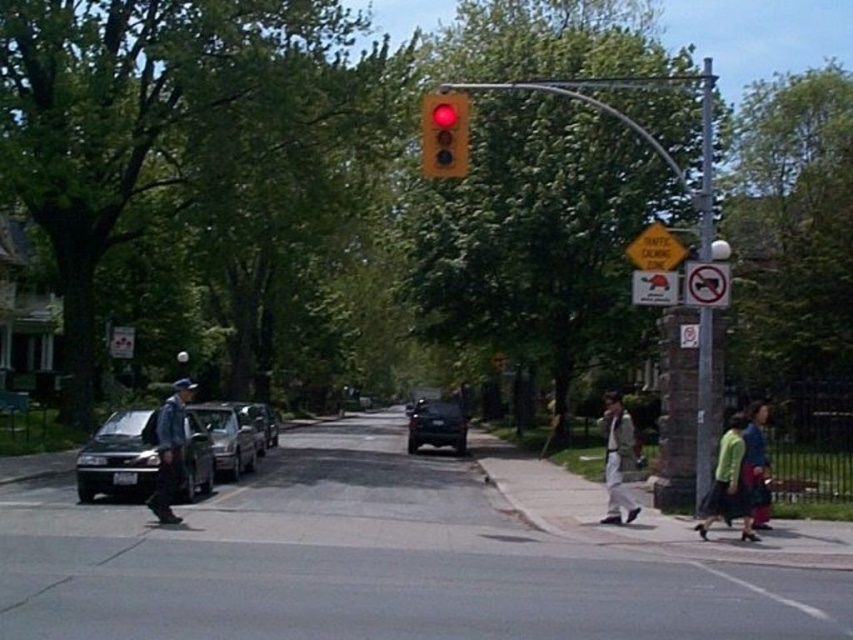
Which is in front, point (463, 436) or point (761, 449)?

Point (761, 449) is more forward.

What do you see at coordinates (437, 426) in the screenshot? This screenshot has height=640, width=853. I see `shiny black sedan at center` at bounding box center [437, 426].

Between point (428, 406) and point (764, 524), which one is positioned in front?

Point (764, 524)

This screenshot has height=640, width=853. Identify the location of shiny black sedan at center. (437, 426).

Is gray asphalt road at center above shiny black sedan at left?

Incorrect, gray asphalt road at center is not positioned above shiny black sedan at left.

Between gray asphalt road at center and shiny black sedan at left, which one is positioned higher?

shiny black sedan at left is higher up.

Identify the location of gray asphalt road at center. (372, 563).

Is point (465, 444) positioned before point (637, 257)?

No, (465, 444) is behind (637, 257).

Does shiny black sedan at center appear on the right side of yellow reflective plastic traffic calming sign at upper center?

Incorrect, shiny black sedan at center is not on the right side of yellow reflective plastic traffic calming sign at upper center.

Is point (466, 432) more distant than point (664, 262)?

Yes.

Find the location of a particular element. This screenshot has height=640, width=853. shiny black sedan at center is located at coordinates (437, 426).